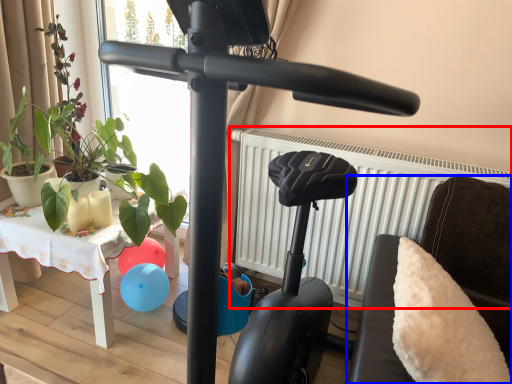
Question: Which object appears closest to the camera in this image, radiator (highlighted by a red box) or furniture (highlighted by a blue box)?

Choices:
 (A) radiator
 (B) furniture

Answer: (B)